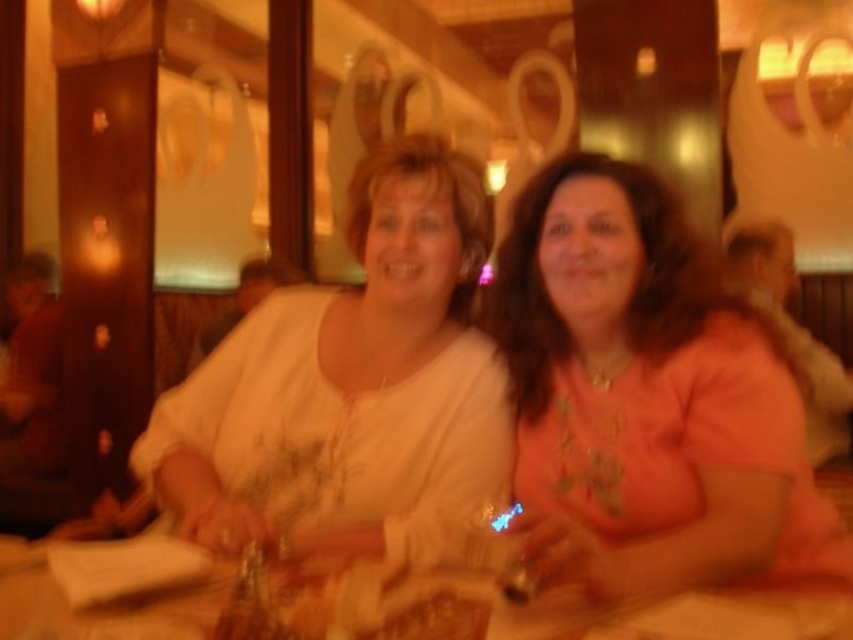
Question: In this image, where is orange matte shirt at right located relative to white satin blouse at center?

Choices:
 (A) left
 (B) right

Answer: (B)

Question: Is orange matte shirt at right smaller than wooden table at center?

Choices:
 (A) yes
 (B) no

Answer: (B)

Question: Is orange matte shirt at right wider than wooden table at center?

Choices:
 (A) no
 (B) yes

Answer: (A)

Question: Which point is closer to the camera taking this photo?

Choices:
 (A) (596, 193)
 (B) (375, 467)
 (C) (345, 620)

Answer: (C)

Question: Estimate the real-world distances between objects in this image. Which object is closer to the orange matte shirt at right?

Choices:
 (A) wooden table at center
 (B) white satin blouse at center

Answer: (B)

Question: Which of the following is the farthest from the observer?

Choices:
 (A) white satin blouse at center
 (B) orange matte shirt at right

Answer: (A)